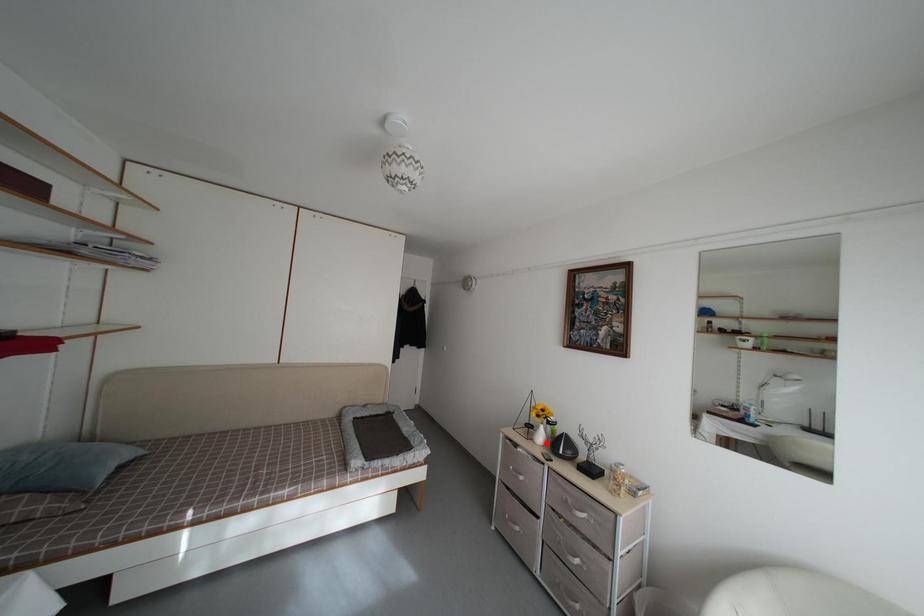
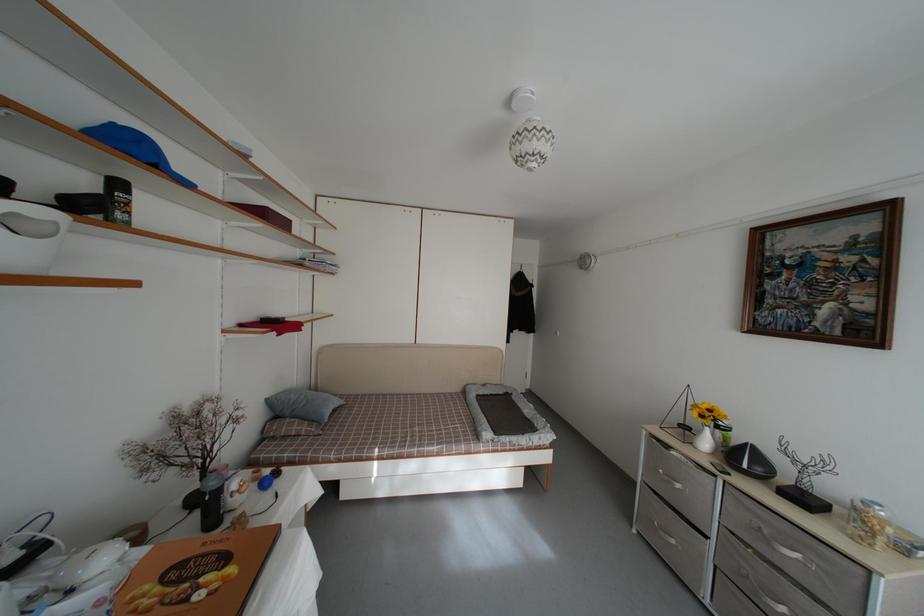
Find the pixel in the second image that matches the highlighted location in the first image.

(711, 448)